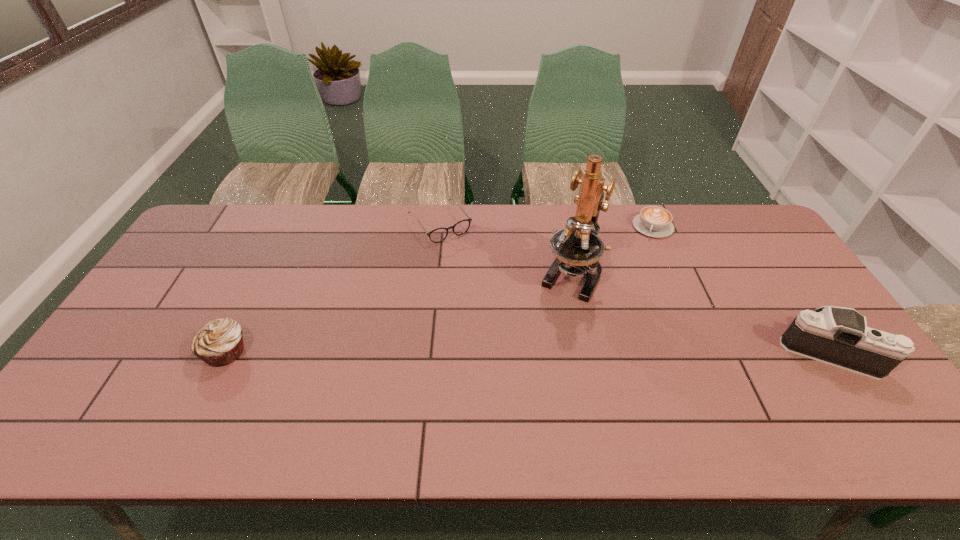
Locate an element on the screen. Image resolution: width=960 pixels, height=540 pixels. vacant space on the desktop that is between the muffin and the fourth shortest object and is positioned at the eyepiece of the third farthest object is located at coordinates (528, 351).

Image resolution: width=960 pixels, height=540 pixels. I want to click on vacant spot on the desktop that is between the leftmost object and the second tallest object and is positioned through the lenses of the second object from left to right, so click(x=538, y=351).

Where is `vacant spot on the desktop that is between the third shortest object and the camera and is positioned on the side of the second object from right to left with the handle`? vacant spot on the desktop that is between the third shortest object and the camera and is positioned on the side of the second object from right to left with the handle is located at coordinates pyautogui.click(x=605, y=351).